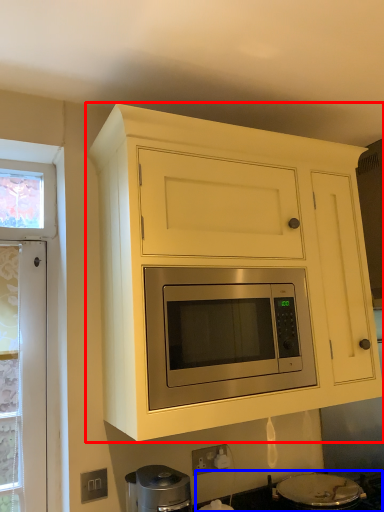
Question: Which point is further to the camera, cabinetry (highlighted by a red box) or gas stove (highlighted by a blue box)?

Choices:
 (A) cabinetry
 (B) gas stove

Answer: (B)